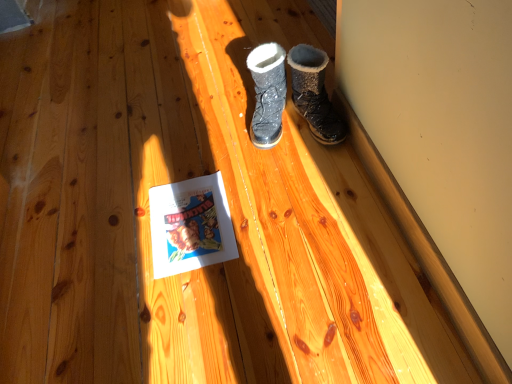
Question: From the image's perspective, is white paper at center under dark brown suede boot at upper right, which ranks as the 2th footwear in left-to-right order?

Choices:
 (A) no
 (B) yes

Answer: (B)

Question: Is white paper at center looking in the opposite direction of dark brown suede boot at upper right, which appears as the first footwear when viewed from the right?

Choices:
 (A) no
 (B) yes

Answer: (A)

Question: Is white paper at center further to camera compared to dark brown suede boot at upper right, which appears as the first footwear when viewed from the right?

Choices:
 (A) yes
 (B) no

Answer: (B)

Question: Does white paper at center have a lesser height compared to dark brown suede boot at upper right, which appears as the first footwear when viewed from the right?

Choices:
 (A) yes
 (B) no

Answer: (A)

Question: Considering the relative positions of white paper at center and dark brown suede boot at upper right, which ranks as the 2th footwear in left-to-right order, in the image provided, is white paper at center to the left of dark brown suede boot at upper right, which ranks as the 2th footwear in left-to-right order, from the viewer's perspective?

Choices:
 (A) no
 (B) yes

Answer: (B)

Question: In terms of width, does sparkly black boot at center, the first footwear from the left, look wider or thinner when compared to dark brown suede boot at upper right, which appears as the first footwear when viewed from the right?

Choices:
 (A) wide
 (B) thin

Answer: (A)

Question: Based on their sizes in the image, would you say sparkly black boot at center, the first footwear from the left, is bigger or smaller than dark brown suede boot at upper right, which appears as the first footwear when viewed from the right?

Choices:
 (A) small
 (B) big

Answer: (A)

Question: From a real-world perspective, relative to dark brown suede boot at upper right, which ranks as the 2th footwear in left-to-right order, is sparkly black boot at center, the first footwear from the left, vertically above or below?

Choices:
 (A) below
 (B) above

Answer: (A)

Question: Would you say sparkly black boot at center, the first footwear from the left, is inside or outside dark brown suede boot at upper right, which appears as the first footwear when viewed from the right?

Choices:
 (A) inside
 (B) outside

Answer: (B)

Question: Is dark brown suede boot at upper right, which ranks as the 2th footwear in left-to-right order, in front of or behind sparkly black boot at center, the first footwear from the left, in the image?

Choices:
 (A) front
 (B) behind

Answer: (A)

Question: Is dark brown suede boot at upper right, which ranks as the 2th footwear in left-to-right order, to the left or to the right of sparkly black boot at center, which is the second footwear in right-to-left order, in the image?

Choices:
 (A) left
 (B) right

Answer: (B)

Question: Does point (310, 122) appear closer or farther from the camera than point (260, 114)?

Choices:
 (A) closer
 (B) farther

Answer: (A)

Question: From a real-world perspective, relative to sparkly black boot at center, which is the second footwear in right-to-left order, is dark brown suede boot at upper right, which appears as the first footwear when viewed from the right, vertically above or below?

Choices:
 (A) above
 (B) below

Answer: (A)

Question: From their relative heights in the image, would you say dark brown suede boot at upper right, which appears as the first footwear when viewed from the right, is taller or shorter than white paper at center?

Choices:
 (A) short
 (B) tall

Answer: (B)

Question: From the image's perspective, relative to white paper at center, is dark brown suede boot at upper right, which ranks as the 2th footwear in left-to-right order, above or below?

Choices:
 (A) above
 (B) below

Answer: (A)